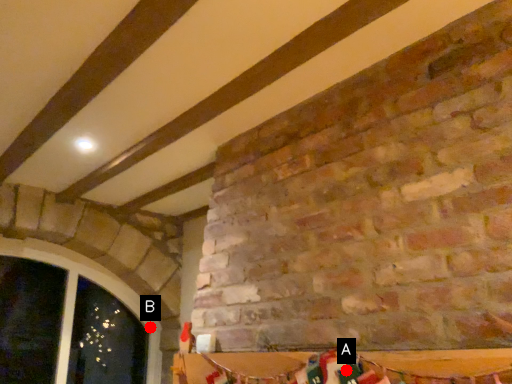
Question: Two points are circled on the image, labeled by A and B beside each circle. Which of the following is the farthest from the observer?

Choices:
 (A) A is further
 (B) B is further

Answer: (B)